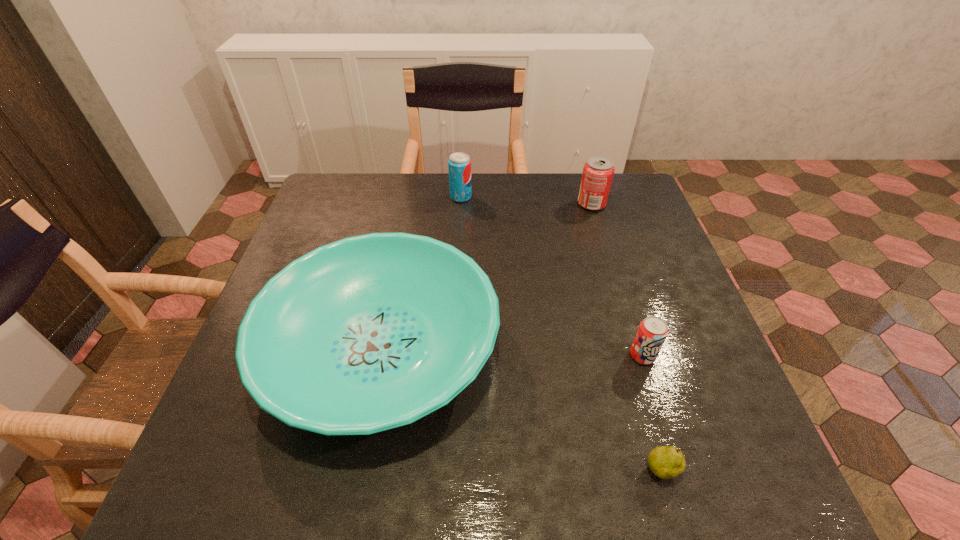
You are a GUI agent. You are given a task and a screenshot of the screen. Output one action in this format:
    pyautogui.click(x=<x>, y=<y>)
    Task: Click on the leftmost soda can
    
    Given the screenshot: What is the action you would take?
    pyautogui.click(x=459, y=164)

In order to click on dish in this screenshot , I will do `click(368, 333)`.

The height and width of the screenshot is (540, 960). I want to click on the shortest soda can, so pos(652,332).

The image size is (960, 540). In order to click on pear in this screenshot , I will do `click(666, 462)`.

Find the location of `free location located 0.240m on the front of the leftmost soda can`. free location located 0.240m on the front of the leftmost soda can is located at coordinates (458, 256).

Where is `free spot located 0.270m on the right of the dish`? This screenshot has width=960, height=540. free spot located 0.270m on the right of the dish is located at coordinates (620, 348).

The image size is (960, 540). Find the location of `vacant space positioned on the front of the nearest soda can`. vacant space positioned on the front of the nearest soda can is located at coordinates (665, 429).

This screenshot has width=960, height=540. I want to click on free space located 0.300m on the back of the shortest object, so click(x=621, y=327).

This screenshot has width=960, height=540. Find the location of `dish that is at the near edge`. dish that is at the near edge is located at coordinates (368, 333).

At what (x,y) coordinates should I click in order to perform the action: click on pear present at the near edge. Please return your answer as a coordinate pair (x, y). Looking at the image, I should click on (666, 462).